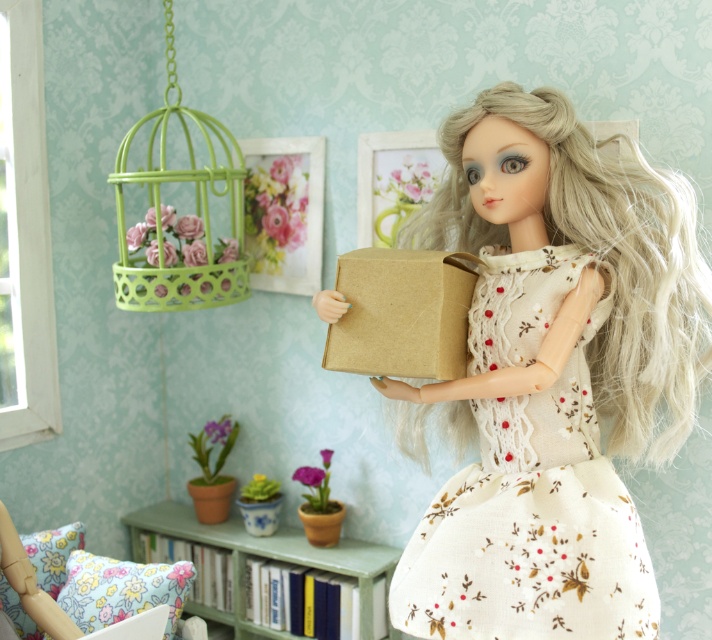
Question: Which object appears closest to the camera in this image?

Choices:
 (A) green wire birdcage at upper left
 (B) green matte plant pot at lower left
 (C) matte brown paper bag at center
 (D) green painted wood bookshelf at lower center

Answer: (C)

Question: Which object appears closest to the camera in this image?

Choices:
 (A) brown/kraft paper box at center
 (B) green glazed pot at lower center

Answer: (A)

Question: Can you confirm if floral printed fabric dress at center is wider than matte brown pot at lower center?

Choices:
 (A) no
 (B) yes

Answer: (B)

Question: Is floral printed fabric dress at center wider than matte brown pot at lower center?

Choices:
 (A) no
 (B) yes

Answer: (B)

Question: Which of the following is the farthest from the observer?

Choices:
 (A) green matte plant pot at lower left
 (B) green glazed pot at lower center
 (C) matte brown pot at lower center
 (D) matte brown paper bag at center

Answer: (A)

Question: Observing the image, what is the correct spatial positioning of matte brown paper bag at center in reference to green wire birdcage at upper left?

Choices:
 (A) left
 (B) right

Answer: (B)